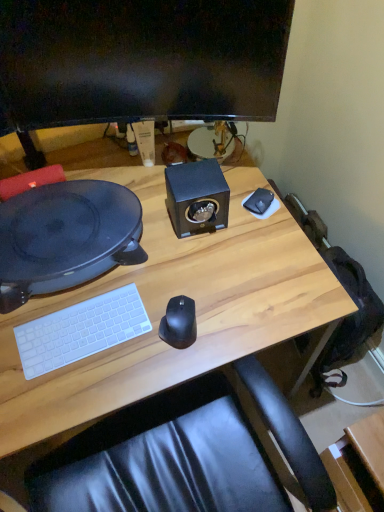
Identify the location of free region on the left part of white matte keyboard at lower left. This screenshot has height=512, width=384. (18, 326).